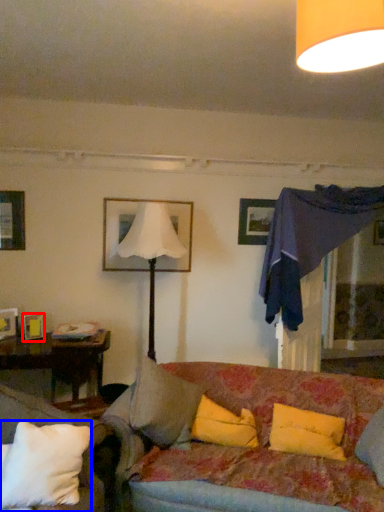
Question: Which point is further to the camera, picture frame (highlighted by a red box) or pillow (highlighted by a blue box)?

Choices:
 (A) picture frame
 (B) pillow

Answer: (A)